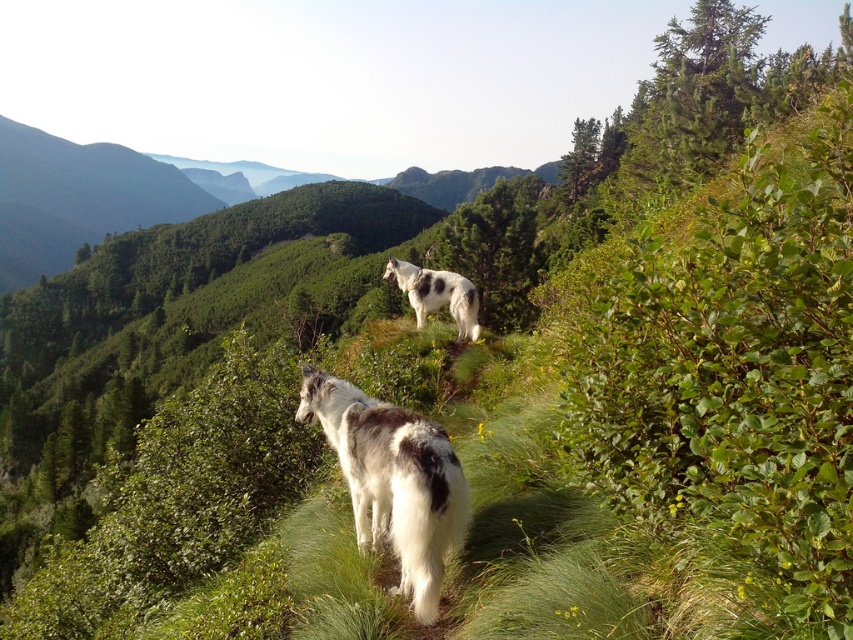
Question: Among these objects, which one is nearest to the camera?

Choices:
 (A) white speckled fur pony at center
 (B) white woolen pony at center

Answer: (B)

Question: Does white woolen pony at center have a larger size compared to white speckled fur pony at center?

Choices:
 (A) yes
 (B) no

Answer: (A)

Question: In this image, where is white woolen pony at center located relative to white speckled fur pony at center?

Choices:
 (A) right
 (B) left

Answer: (B)

Question: From the image, what is the correct spatial relationship of white woolen pony at center in relation to white speckled fur pony at center?

Choices:
 (A) below
 (B) above

Answer: (A)

Question: Which point appears farthest from the camera in this image?

Choices:
 (A) (415, 272)
 (B) (440, 449)

Answer: (A)